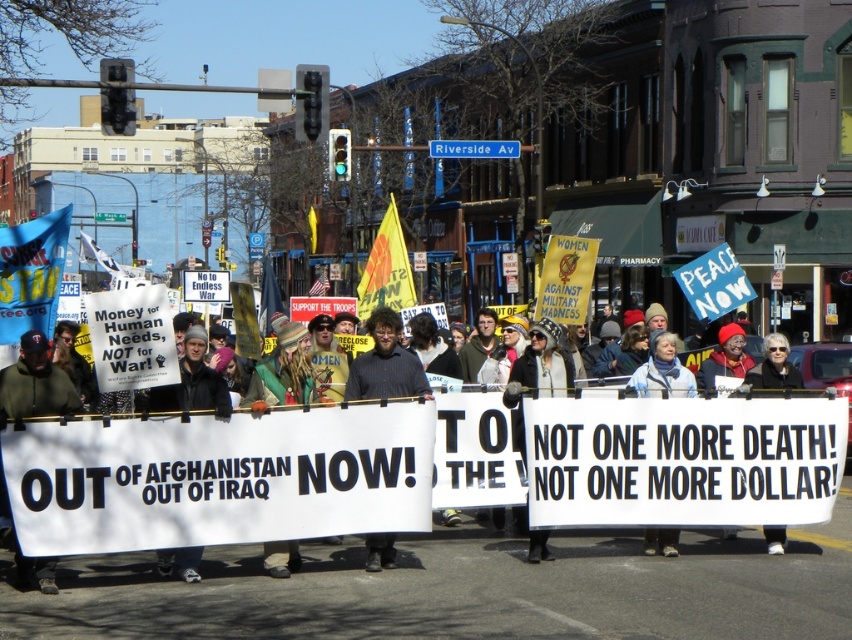
You are a photographer trying to capture a photo of the protest march. You notice the black fabric sign at lower left and the black leather jacket at center in your frame. Which object should you adjust your camera angle to focus on if you want to highlight the taller object?

The black leather jacket at center is taller than the black fabric sign at lower left, so you should focus on the black leather jacket at center to highlight the taller object.

What is the spatial relationship between the black fabric sign at lower left and the black leather jacket at center?

Answer: The black fabric sign at lower left is to the left of the black leather jacket at center.